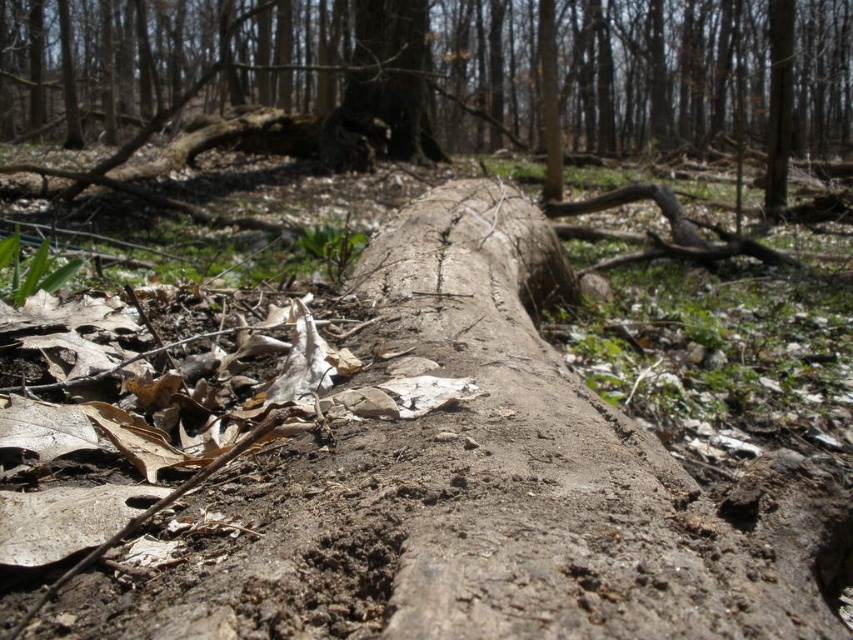
Question: Which object is farther from the camera taking this photo?

Choices:
 (A) smooth bark log at center
 (B) smooth brown log at center

Answer: (B)

Question: Which of the following is the farthest from the observer?

Choices:
 (A) smooth bark log at center
 (B) smooth brown log at center

Answer: (B)

Question: Considering the relative positions of smooth bark log at center and smooth brown log at center in the image provided, where is smooth bark log at center located with respect to smooth brown log at center?

Choices:
 (A) below
 (B) above

Answer: (B)

Question: Which point appears closest to the camera in this image?

Choices:
 (A) (520, 45)
 (B) (413, 61)

Answer: (B)

Question: Observing the image, what is the correct spatial positioning of smooth bark log at center in reference to smooth brown log at center?

Choices:
 (A) left
 (B) right

Answer: (B)

Question: Can you confirm if smooth bark log at center is wider than smooth brown log at center?

Choices:
 (A) no
 (B) yes

Answer: (B)